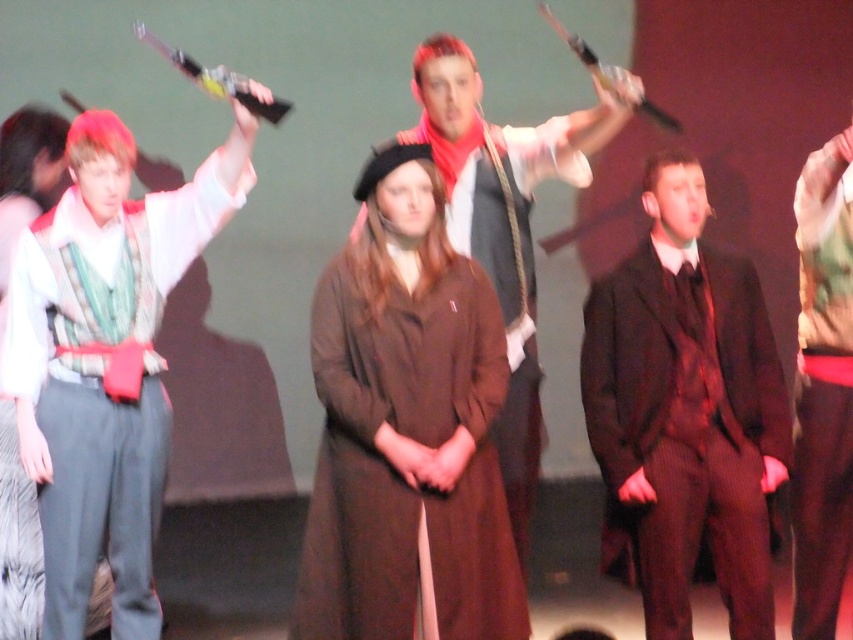
Based on the scene description, which object is smaller in size between the brown woolen coat at center and the dark brown suit at center?

The brown woolen coat at center is smaller in size compared to the dark brown suit at center.

You are standing on the stage and want to move from the point marked as point [723,509] to the point marked as point [827,435]. Which direction should you move to reach your destination?

To move from point [723,509] to point [827,435], you should move backward since point [723,509] is in front of point [827,435].

You are an observer on the stage. There is a dark brown suit at center and a camouflage fabric jacket at right. Which one is positioned to the left?

The dark brown suit at center is positioned to the left of the camouflage fabric jacket at right.